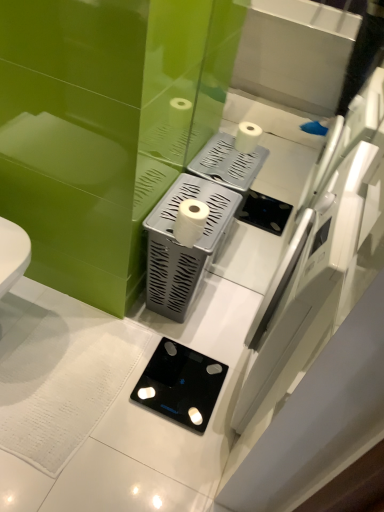
What are the coordinates of `free point to the left of black glass scale at lower center` in the screenshot? It's located at (114, 371).